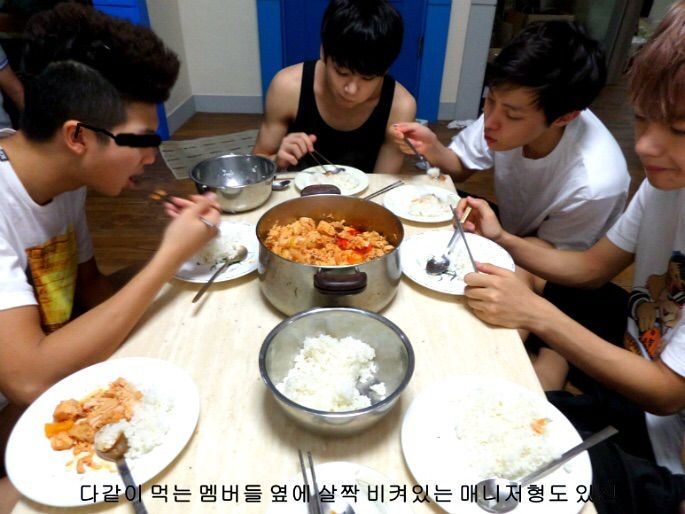
The width and height of the screenshot is (685, 514). I want to click on bowl of rice, so click(327, 377).